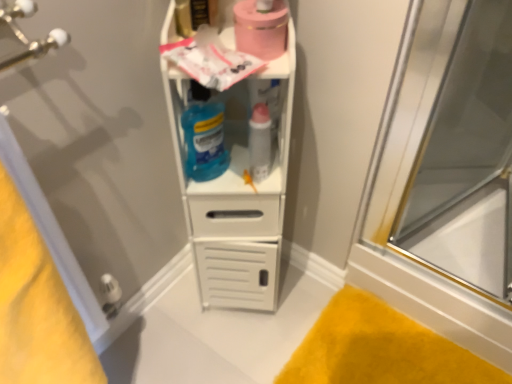
You are a GUI agent. You are given a task and a screenshot of the screen. Output one action in this format:
    pyautogui.click(x=<x>, y=<y>)
    Task: Click on the vacant space that is to the left of yellow plush bath mat at lower right
    
    Given the screenshot: What is the action you would take?
    pyautogui.click(x=249, y=340)